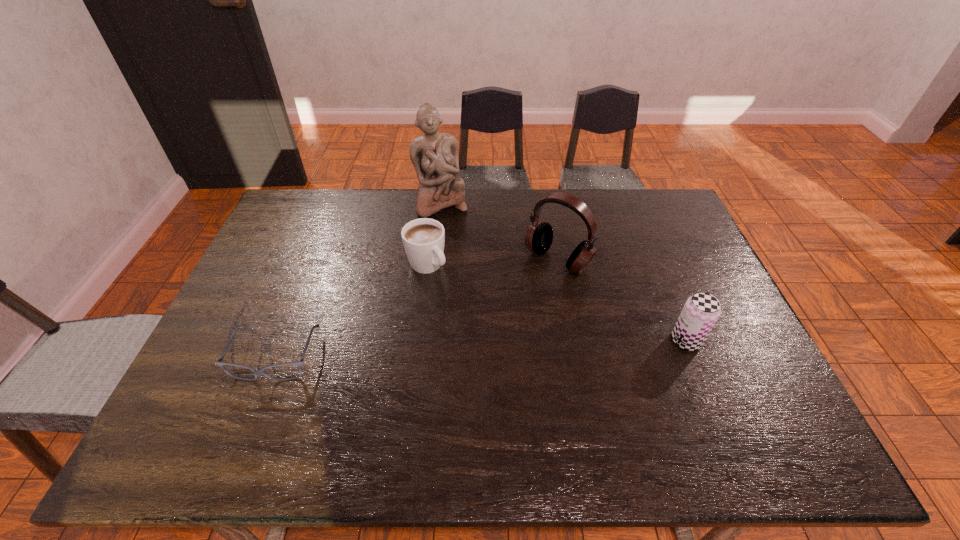
You are a GUI agent. You are given a task and a screenshot of the screen. Output one action in this format:
    pyautogui.click(x=<x>, y=<y>)
    Task: Click on the vacant point located between the second shortest object and the headset
    This screenshot has height=540, width=960.
    Given the screenshot: What is the action you would take?
    pyautogui.click(x=492, y=262)

You are a GUI agent. You are given a task and a screenshot of the screen. Output one action in this format:
    pyautogui.click(x=<x>, y=<y>)
    Task: Click on the empty location between the cappuccino and the second tallest object
    
    Given the screenshot: What is the action you would take?
    (492, 262)

Locate an element on the screen. This screenshot has height=540, width=960. unoccupied position between the spectacles and the headset is located at coordinates (417, 308).

This screenshot has width=960, height=540. In order to click on vacant area that lies between the third shortest object and the second shortest object in this screenshot , I will do `click(557, 303)`.

Where is `vacant point located between the tallest object and the shortest object`? vacant point located between the tallest object and the shortest object is located at coordinates (358, 281).

Locate an element on the screen. free space between the beer can and the tallest object is located at coordinates (564, 272).

Identify the location of vacant space that is in between the cappuccino and the headset. Image resolution: width=960 pixels, height=540 pixels. (492, 262).

Find the location of a particular element. empty location between the fourth tallest object and the leftmost object is located at coordinates (351, 311).

Find the location of a particular element. vacant area that lies between the shortest object and the cappuccino is located at coordinates (351, 311).

I want to click on empty space that is in between the spectacles and the headset, so click(x=417, y=308).